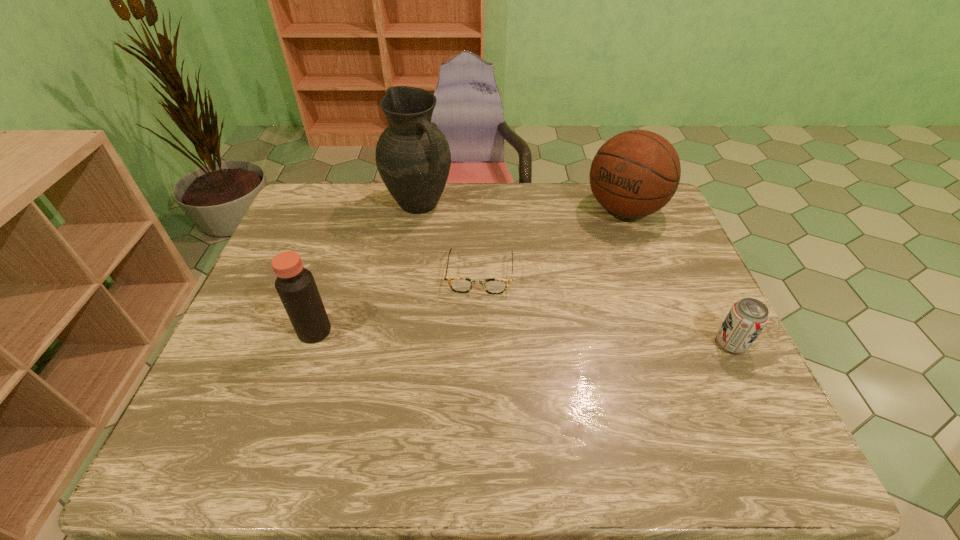
At what (x,y) coordinates should I click in order to perform the action: click on vacant point located on the side of the pitcher with the handle. Please return your answer as a coordinate pair (x, y). The height and width of the screenshot is (540, 960). Looking at the image, I should click on (504, 281).

You are a GUI agent. You are given a task and a screenshot of the screen. Output one action in this format:
    pyautogui.click(x=<x>, y=<y>)
    Task: Click on the vacant space located 0.060m on the frame of the third nearest object
    
    Given the screenshot: What is the action you would take?
    pyautogui.click(x=476, y=312)

Locate an element on the screen. This screenshot has width=960, height=540. free region located on the frame of the third nearest object is located at coordinates (473, 343).

Identify the location of vacant position located 0.290m on the frame of the third nearest object. (469, 391).

Where is `vacant position located on the side with brand label of the basketball`? The height and width of the screenshot is (540, 960). vacant position located on the side with brand label of the basketball is located at coordinates (587, 247).

The height and width of the screenshot is (540, 960). I want to click on vacant position located 0.210m on the side with brand label of the basketball, so click(568, 264).

Find the location of `vacant space located on the side with brand label of the basketball`. vacant space located on the side with brand label of the basketball is located at coordinates (559, 273).

Locate an element on the screen. This screenshot has width=960, height=540. pitcher positioned at the far edge is located at coordinates tap(413, 158).

Identify the location of basketball that is at the far edge. point(635,173).

Where is `object located at the left edge`? object located at the left edge is located at coordinates (295, 285).